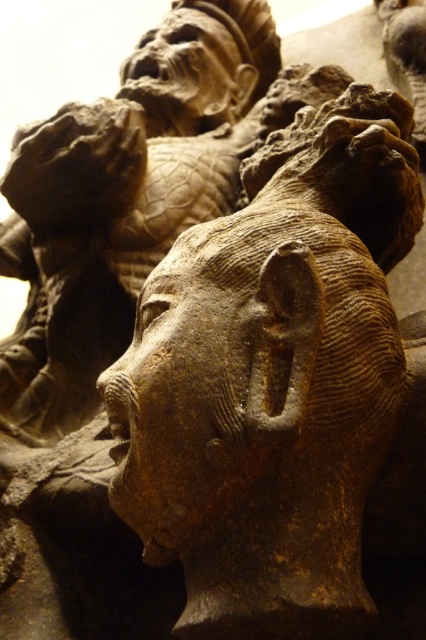
You are an art conservator examining the sculpture. You notice two points on the sculpture marked as point 1 at coordinates point (235, 456) and point 2 at coordinates point (207, 109). From your vantage point, which point is closer to you?

Point (235, 456) is in front of point (207, 109), so point 1 at coordinates point (235, 456) is closer to you.

You are an art conservator examining a sculpture. You notice two faces carved into the stone. The brown stone face at center and the matte stone face at upper center. Which of these two faces is narrower in width?

The brown stone face at center has a lesser width compared to matte stone face at upper center, so the brown stone face at center is narrower.